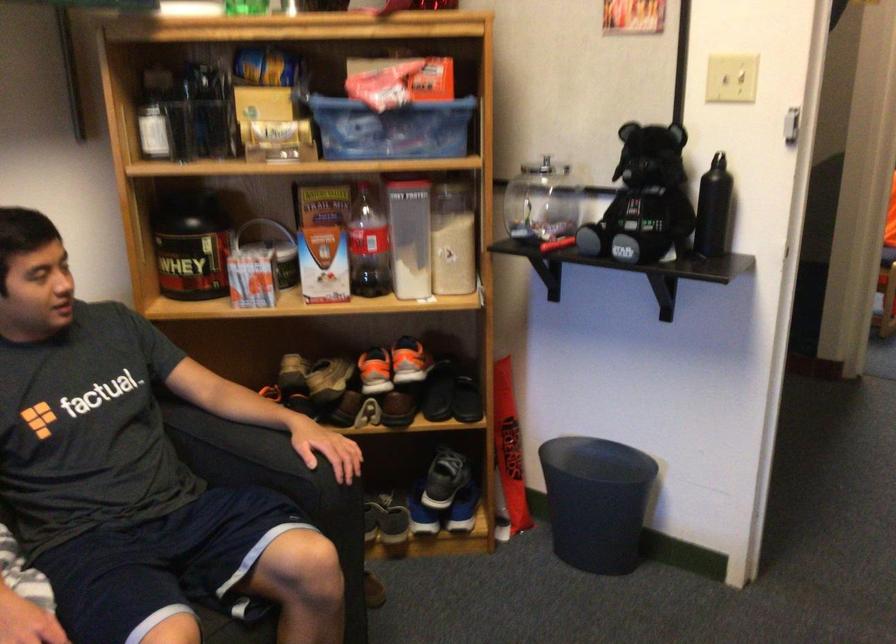
Find where to lift the grey trash can. Please return your answer as a coordinate pair (x, y).

(597, 500)